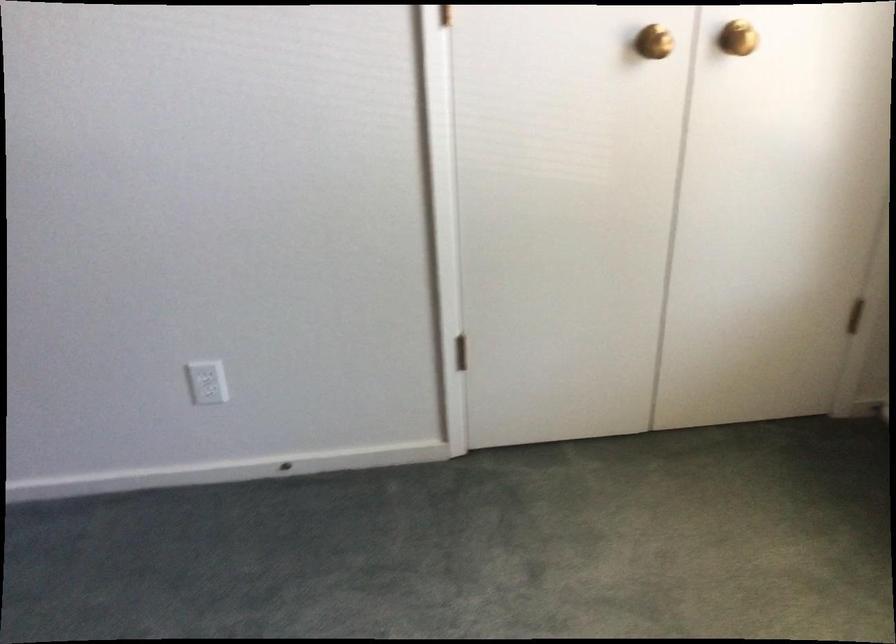
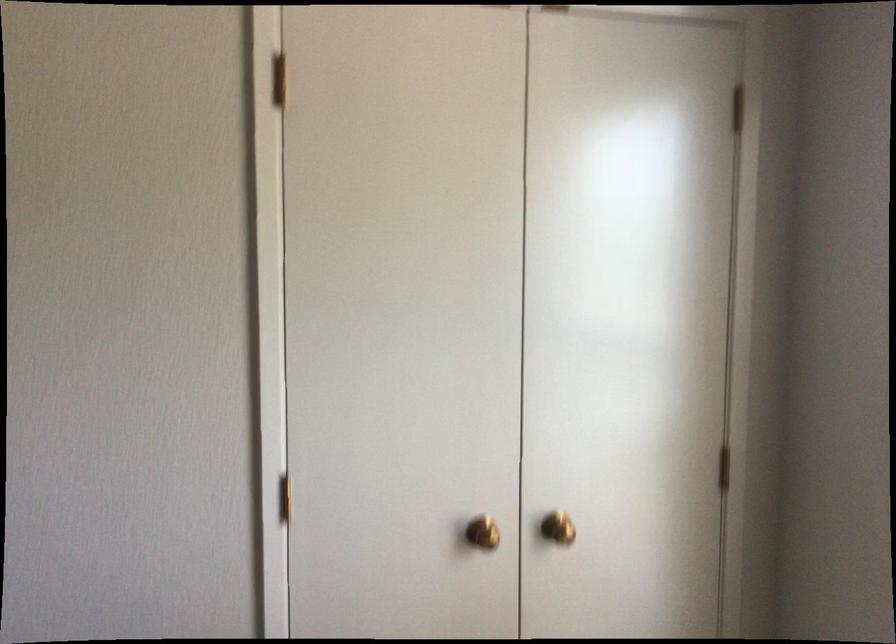
Question: The images are taken continuously from a first-person perspective. In which direction is your viewpoint rotating?

Choices:
 (A) Left
 (B) Right
 (C) Up
 (D) Down

Answer: (C)